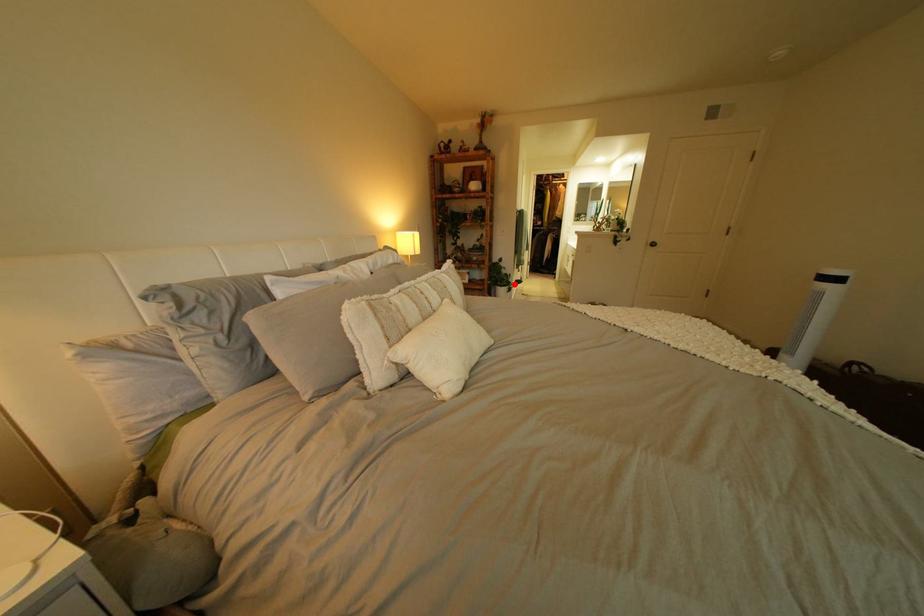
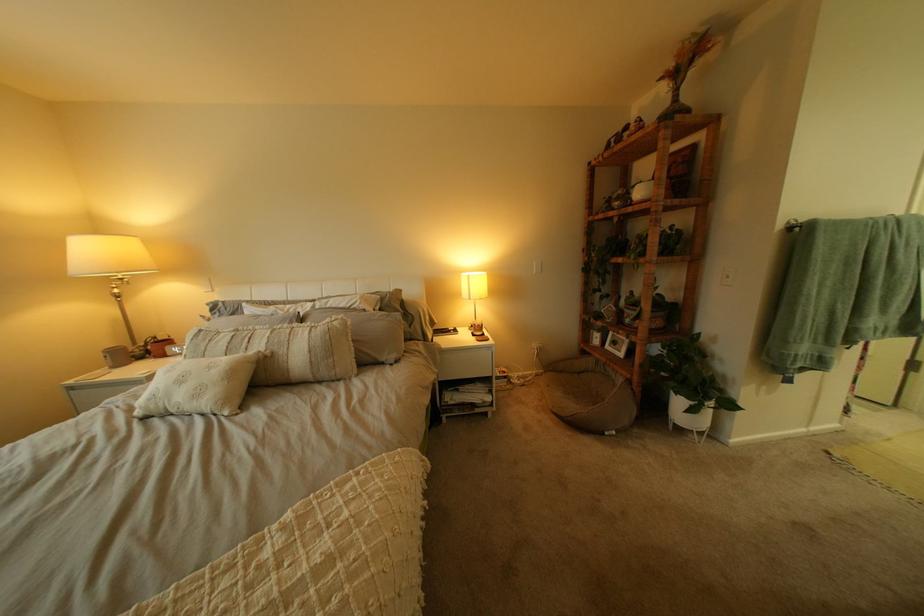
In the second image, find the point that corresponds to the highlighted location in the first image.

(687, 385)